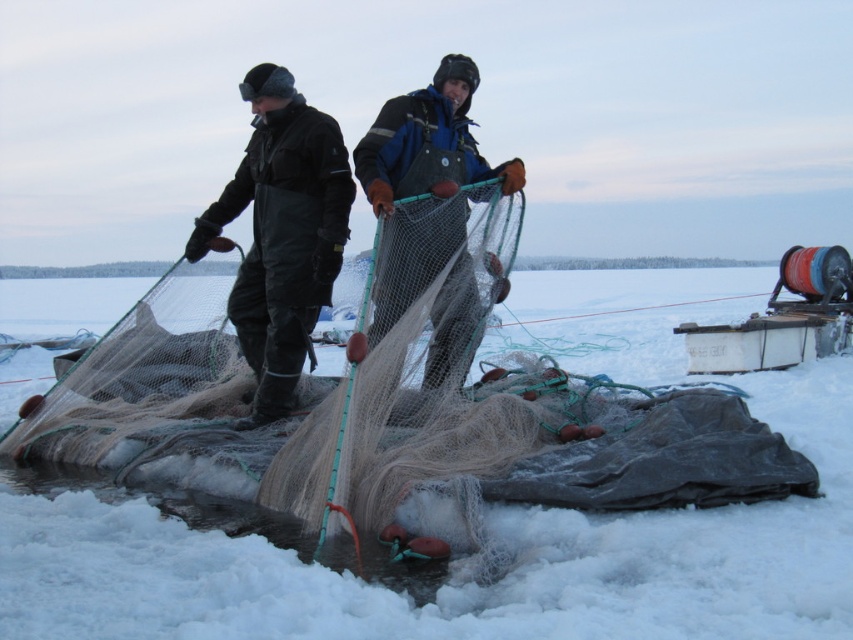
Question: Among these points, which one is farthest from the camera?

Choices:
 (A) (276, 262)
 (B) (509, 179)

Answer: (B)

Question: Which point is farther to the camera?

Choices:
 (A) dark green waterproof overalls at center
 (B) white fluffy snow at center
 (C) blue fabric net at center

Answer: (A)

Question: Is dark green waterproof overalls at center to the left of blue fabric net at center from the viewer's perspective?

Choices:
 (A) yes
 (B) no

Answer: (A)

Question: Can you confirm if white fluffy snow at center is wider than dark green waterproof overalls at center?

Choices:
 (A) yes
 (B) no

Answer: (A)

Question: Which point is farther to the camera?

Choices:
 (A) white fluffy snow at center
 (B) dark green waterproof overalls at center

Answer: (B)

Question: Where is white fluffy snow at center located in relation to dark green waterproof overalls at center in the image?

Choices:
 (A) left
 (B) right

Answer: (B)